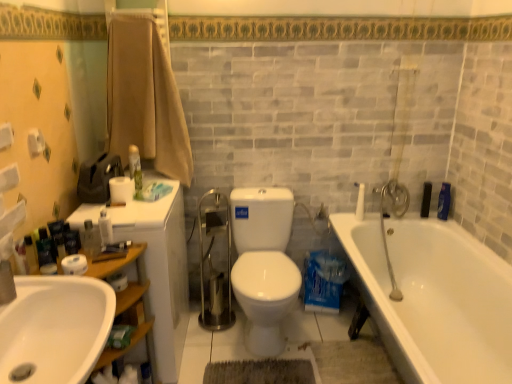
Where is `vacant position to the left of blue plastic bottle at right, the 6th toiletry from the left`? vacant position to the left of blue plastic bottle at right, the 6th toiletry from the left is located at coordinates (426, 218).